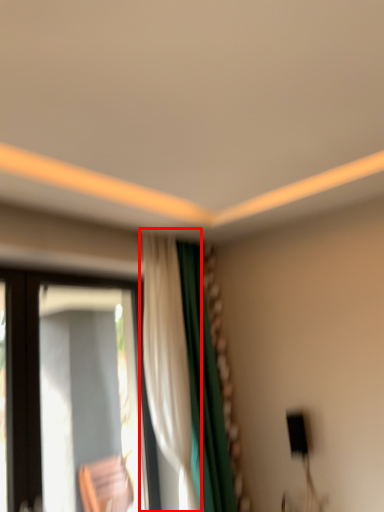
Question: From the image's perspective, where is curtain (annotated by the red box) located relative to window?

Choices:
 (A) below
 (B) above

Answer: (B)